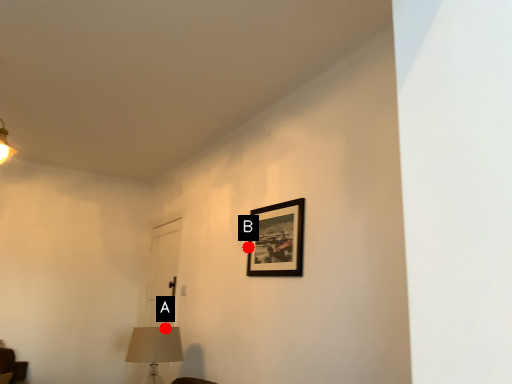
Question: Two points are circled on the image, labeled by A and B beside each circle. Which of the following is the farthest from the observer?

Choices:
 (A) A is further
 (B) B is further

Answer: (A)